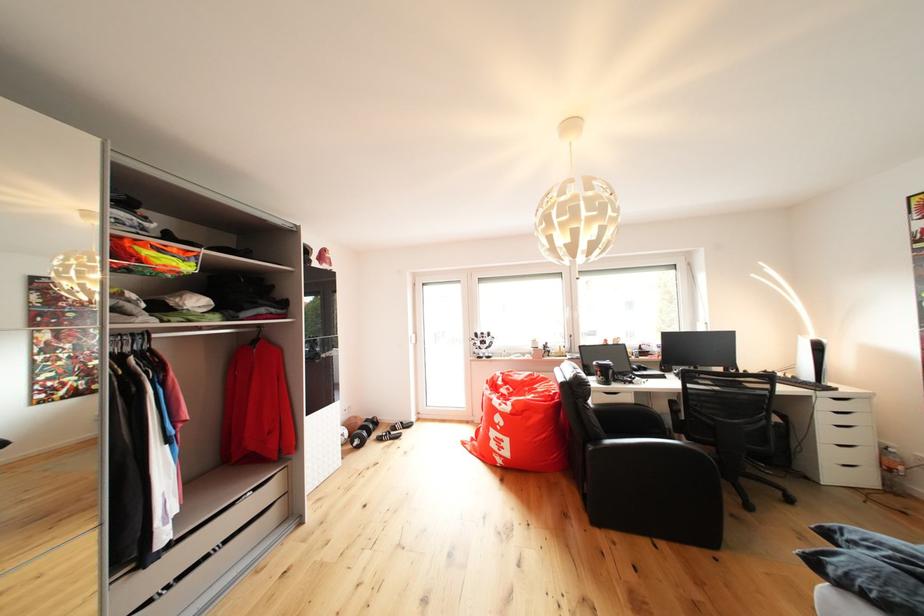
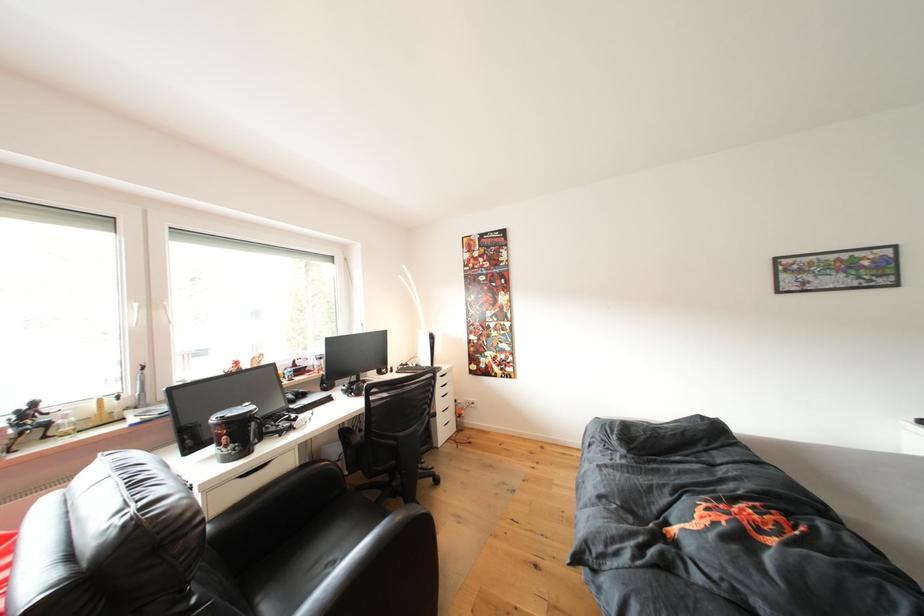
In the second image, find the point that corresponds to (615,379) in the first image.

(253, 440)